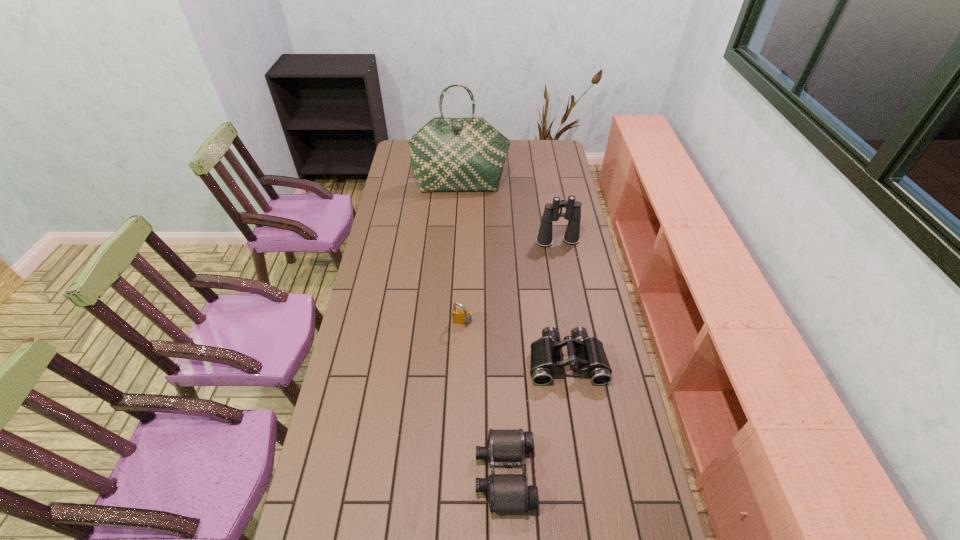
Locate an element on the screen. Image resolution: width=960 pixels, height=540 pixels. free space at the right edge is located at coordinates (608, 395).

The height and width of the screenshot is (540, 960). In order to click on free space between the third nearest object and the tallest binoculars in this screenshot , I will do `click(510, 282)`.

The height and width of the screenshot is (540, 960). I want to click on vacant area that lies between the second tallest binoculars and the tallest binoculars, so click(x=563, y=301).

In order to click on free spot between the third farthest object and the tallest object in this screenshot , I will do `click(462, 255)`.

Locate an element on the screen. This screenshot has height=540, width=960. free space that is in between the farthest binoculars and the third tallest object is located at coordinates (510, 282).

I want to click on free space between the fourth shortest object and the third tallest object, so click(510, 282).

In order to click on free spot between the tallest object and the padlock in this screenshot , I will do `click(462, 255)`.

Find the location of `empty space that is in between the nearest object and the tote bag`. empty space that is in between the nearest object and the tote bag is located at coordinates (483, 330).

Where is `free space between the fourth shortest object and the third nearest object`? The width and height of the screenshot is (960, 540). free space between the fourth shortest object and the third nearest object is located at coordinates (510, 282).

Locate an element on the screen. free area in between the tote bag and the second shortest object is located at coordinates pos(514,273).